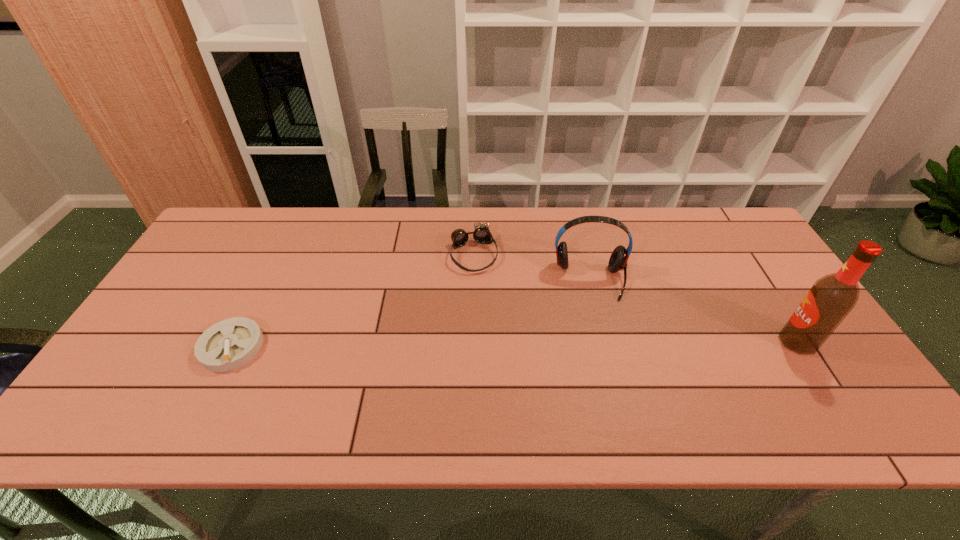
In the image, there is a desktop. At what (x,y) coordinates should I click in order to perform the action: click on vacant space at the near edge. Please return your answer as a coordinate pair (x, y). Looking at the image, I should click on point(695,390).

At what (x,y) coordinates should I click in order to perform the action: click on free region at the left edge of the desktop. Please return your answer as a coordinate pair (x, y). The width and height of the screenshot is (960, 540). Looking at the image, I should click on (204, 281).

In the image, there is a desktop. Where is `vacant space at the right edge`? vacant space at the right edge is located at coordinates (x=769, y=314).

The height and width of the screenshot is (540, 960). In the image, there is a desktop. Find the location of `vacant space at the far right corner`. vacant space at the far right corner is located at coordinates (723, 248).

Identify the location of vacant area between the ashtray and the headset. (411, 313).

In order to click on free spot between the leftmost object and the headset in this screenshot , I will do `click(411, 313)`.

Locate an element on the screen. Image resolution: width=960 pixels, height=540 pixels. free space between the goggles and the tallest object is located at coordinates (636, 298).

The height and width of the screenshot is (540, 960). Find the location of `vacant region between the beer bottle and the third object from left to right`. vacant region between the beer bottle and the third object from left to right is located at coordinates (694, 310).

You are a GUI agent. You are given a task and a screenshot of the screen. Output one action in this format:
    pyautogui.click(x=<x>, y=<y>)
    Task: Click on the vacant area that lies between the rightmost object and the headset
    This screenshot has height=540, width=960.
    Given the screenshot: What is the action you would take?
    pyautogui.click(x=694, y=310)

Locate an element on the screen. free spot between the beer bottle and the shortest object is located at coordinates (515, 344).